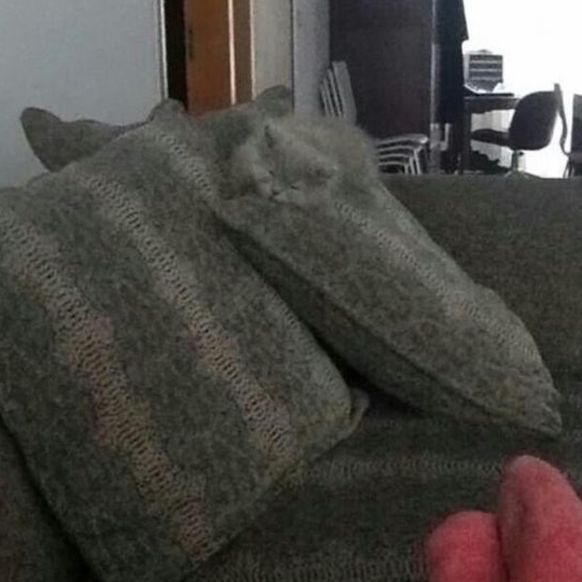
Identify the location of stack of chairs. (399, 147).